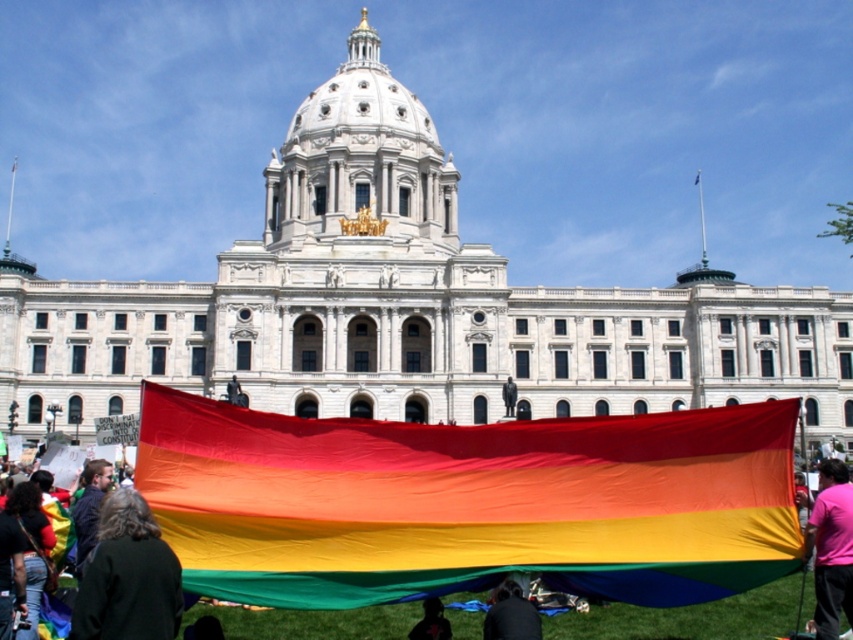
Question: Which point is closer to the camera?

Choices:
 (A) (839, 536)
 (B) (277, 500)

Answer: (B)

Question: Is rainbow fabric flag at center below silhouette fabric at lower center?

Choices:
 (A) no
 (B) yes

Answer: (A)

Question: Which point is closer to the camera taking this photo?

Choices:
 (A) (144, 604)
 (B) (73, 616)

Answer: (B)

Question: Is rainbow fabric at lower left closer to the viewer compared to silhouette fabric at lower center?

Choices:
 (A) yes
 (B) no

Answer: (A)

Question: Which point is farther to the camera?

Choices:
 (A) dark brown leather jacket at lower left
 (B) white stone building at center
 (C) rainbow fabric flag at center
 (D) green fabric jacket at lower left

Answer: (B)

Question: In this image, where is dark brown leather jacket at lower left located relative to silhouette fabric at lower center?

Choices:
 (A) above
 (B) below

Answer: (A)